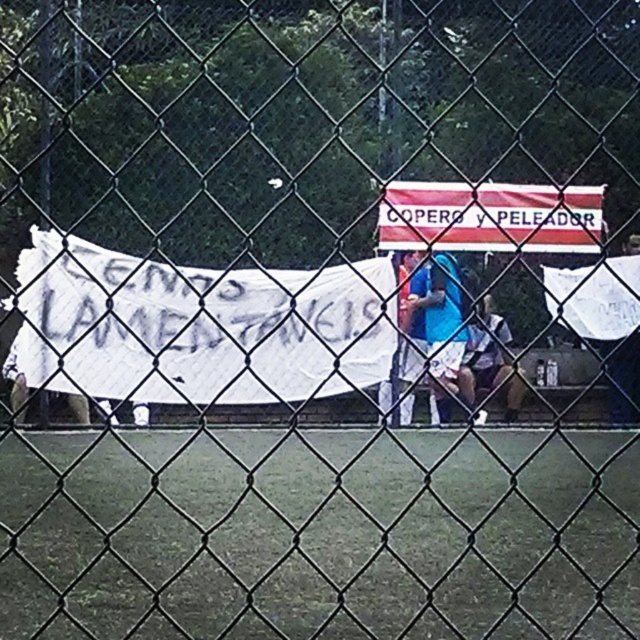
You are a photographer standing behind a chain link fence taking a picture of the scene. You notice the white paper banner at center and the white fabric shirt at center. Which object is positioned to the left of the other?

The white paper banner at center is to the left of the white fabric shirt at center.

You are standing in front of the chain link fence and see two points marked on the image. Which point is closer to you, point (19, 260) or point (506, 333)?

Point (19, 260) is closer to the viewer than point (506, 333).